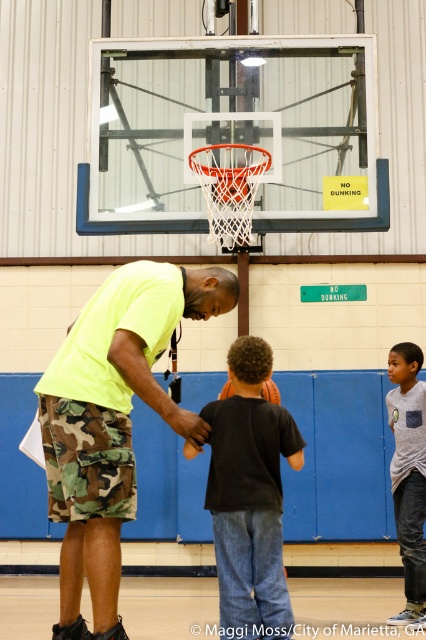
Question: Does black cotton shirt at center appear on the left side of gray cotton shirt at right?

Choices:
 (A) yes
 (B) no

Answer: (A)

Question: Can you confirm if black cotton shirt at center is bigger than rubber basketball at center?

Choices:
 (A) no
 (B) yes

Answer: (B)

Question: Considering the real-world distances, which object is closest to the black cotton shirt at center?

Choices:
 (A) neon yellow shirt at center
 (B) wooden floor at center
 (C) gray cotton shirt at right

Answer: (A)

Question: Which of the following is the farthest from the observer?

Choices:
 (A) wooden floor at center
 (B) black cotton shirt at center

Answer: (A)

Question: Does black cotton shirt at center have a greater width compared to gray cotton shirt at right?

Choices:
 (A) no
 (B) yes

Answer: (B)

Question: Considering the real-world distances, which object is closest to the black cotton shirt at center?

Choices:
 (A) rubber basketball at center
 (B) wooden floor at center

Answer: (B)